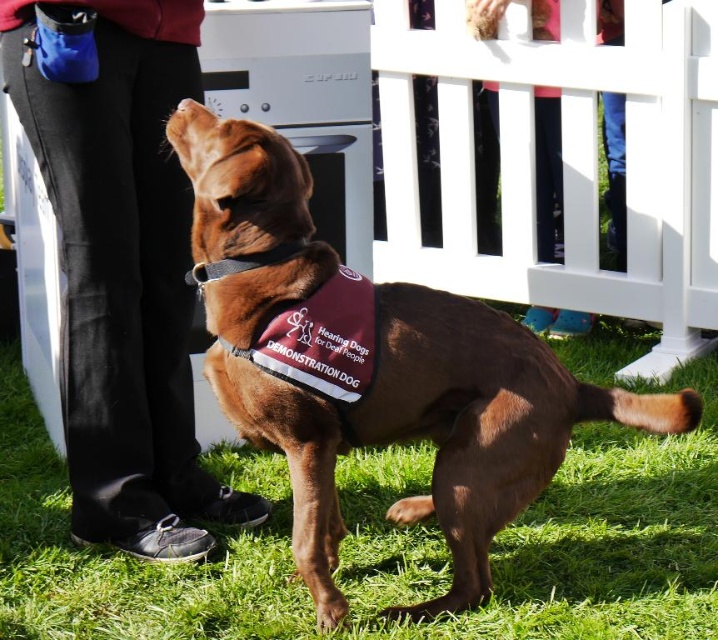
Question: Among these objects, which one is farthest from the camera?

Choices:
 (A) black leather neckband at center
 (B) pink fabric at upper center
 (C) white wooden fence at upper center

Answer: (B)

Question: Which object is closer to the camera taking this photo?

Choices:
 (A) white wooden fence at upper center
 (B) green grass at lower center
 (C) brown fabric vest at center

Answer: (C)

Question: Can you confirm if green grass at lower center is smaller than white wooden fence at upper center?

Choices:
 (A) yes
 (B) no

Answer: (B)

Question: Estimate the real-world distances between objects in this image. Which object is closer to the black leather neckband at center?

Choices:
 (A) white wooden fence at upper center
 (B) pink fabric at upper center
 (C) brown fabric vest at center

Answer: (C)

Question: Does white wooden fence at upper center appear on the left side of black leather neckband at center?

Choices:
 (A) yes
 (B) no

Answer: (B)

Question: Can you confirm if black leather pants at left is positioned above pink fabric at upper center?

Choices:
 (A) yes
 (B) no

Answer: (B)